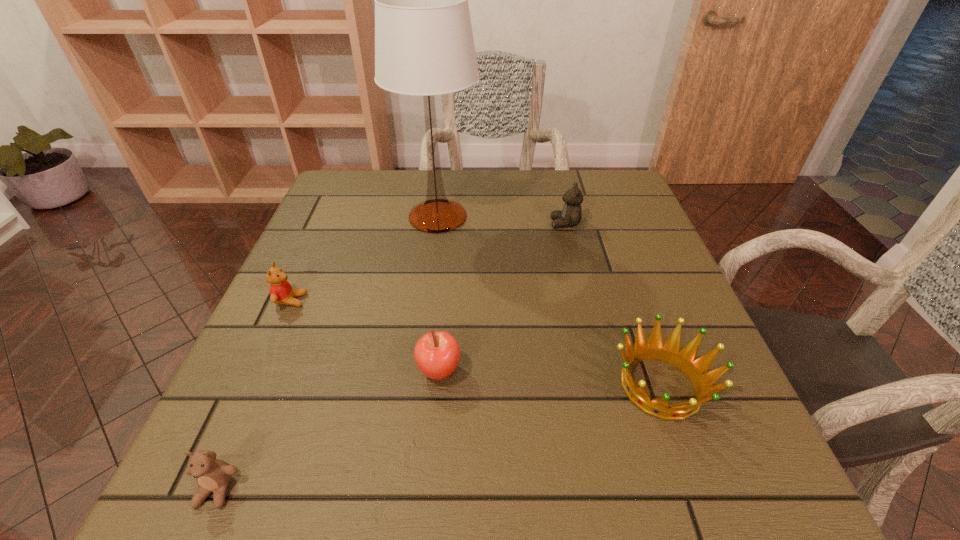
Image resolution: width=960 pixels, height=540 pixels. Identify the location of table lamp. (424, 45).

This screenshot has width=960, height=540. I want to click on the farthest teddy bear, so click(x=571, y=214).

What are the coordinates of `the tallest teddy bear` in the screenshot? It's located at (571, 214).

Locate an element on the screen. This screenshot has width=960, height=540. apple is located at coordinates (437, 353).

Find the location of a particular element. the fourth nearest object is located at coordinates (281, 292).

The height and width of the screenshot is (540, 960). I want to click on crown, so click(x=669, y=352).

This screenshot has width=960, height=540. What are the coordinates of `the nearest teddy bear` in the screenshot? It's located at (213, 475).

This screenshot has height=540, width=960. I want to click on free space located 0.370m above the cylindrical shade of the tallest object, so click(624, 217).

The width and height of the screenshot is (960, 540). What are the coordinates of `free location located 0.120m on the face of the farthest teddy bear` in the screenshot? It's located at (502, 224).

Where is `vacant space located 0.070m on the face of the farthest teddy bear`? vacant space located 0.070m on the face of the farthest teddy bear is located at coordinates (522, 224).